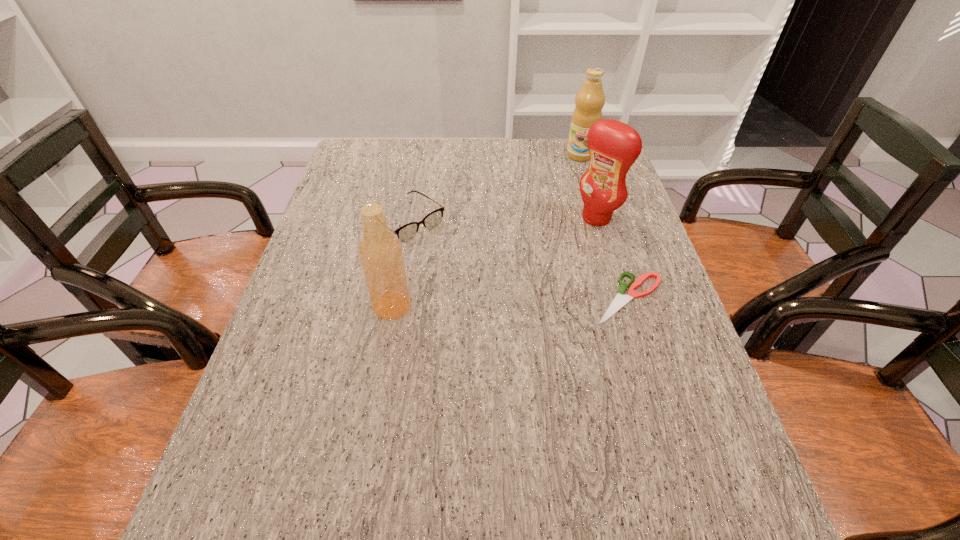
I want to click on free location that satisfies the following two spatial constraints: 1. on the front side of the condiment; 2. on the left side of the shortest object, so click(620, 298).

This screenshot has width=960, height=540. Identify the location of vacant area in the image that satisfies the following two spatial constraints: 1. on the front side of the shortest object; 2. on the left side of the condiment. (620, 298).